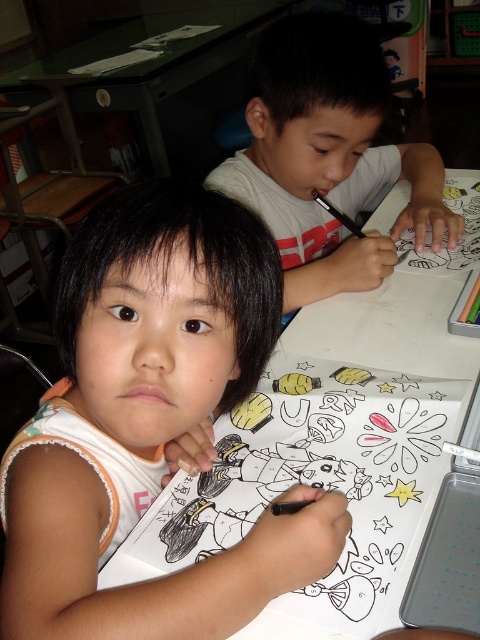
Question: Which is nearer to the matte green crayon at upper right?

Choices:
 (A) white matte shirt at upper center
 (B) matte orange shirt at center
 (C) black ink pen at upper center

Answer: (C)

Question: Where is matte orange shirt at center located in relation to matte green crayon at upper right in the image?

Choices:
 (A) left
 (B) right

Answer: (A)

Question: Is white matte shirt at upper center in front of matte green crayon at upper right?

Choices:
 (A) no
 (B) yes

Answer: (B)

Question: Is white matte shirt at upper center to the right of matte green crayon at upper right from the viewer's perspective?

Choices:
 (A) yes
 (B) no

Answer: (B)

Question: Which object is positioned farthest from the white matte shirt at upper center?

Choices:
 (A) matte green crayon at upper right
 (B) matte orange shirt at center

Answer: (B)

Question: Which object is the farthest from the black ink pen at upper center?

Choices:
 (A) matte green crayon at upper right
 (B) matte orange shirt at center

Answer: (A)